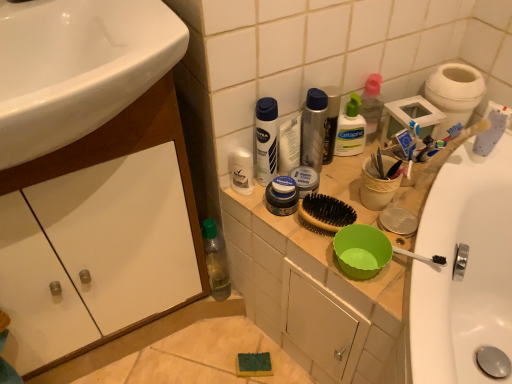
What are the coordinates of `free space to the right of matte silver container at center, which is the third toiletry in right-to-left order` in the screenshot? It's located at (353, 186).